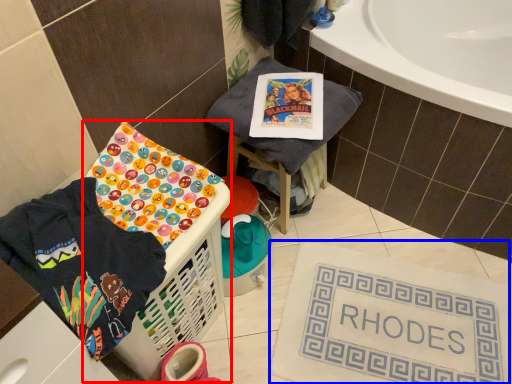
Question: Which point is further to the camera, basket container (highlighted by a red box) or bath mat (highlighted by a blue box)?

Choices:
 (A) basket container
 (B) bath mat

Answer: (B)